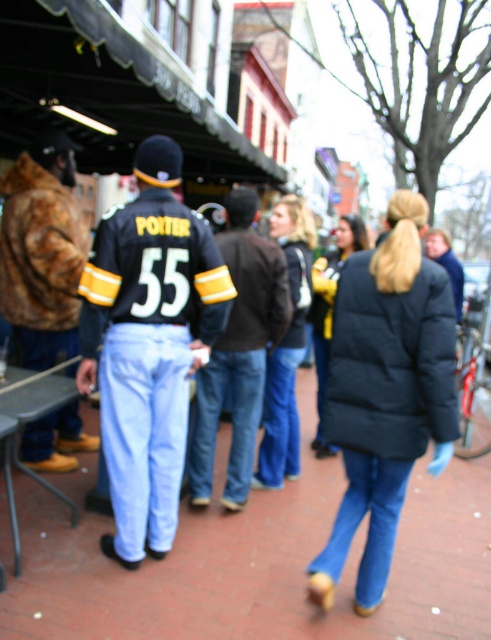
Question: Does black matte jacket at center have a smaller size compared to fur coat at left?

Choices:
 (A) yes
 (B) no

Answer: (B)

Question: Which point is farther to the camera?

Choices:
 (A) click(155, 138)
 (B) click(38, 396)

Answer: (A)

Question: Which point is closer to the camera?

Choices:
 (A) fur coat at left
 (B) black jersey at center

Answer: (B)

Question: Does blue jeans at center appear on the right side of black matte jacket at center?

Choices:
 (A) no
 (B) yes

Answer: (B)

Question: Which object is closer to the camera taking this photo?

Choices:
 (A) black jersey at center
 (B) dark blue jeans at center

Answer: (A)

Question: Can you confirm if blue jeans at center is positioned below fur coat at left?

Choices:
 (A) no
 (B) yes

Answer: (B)